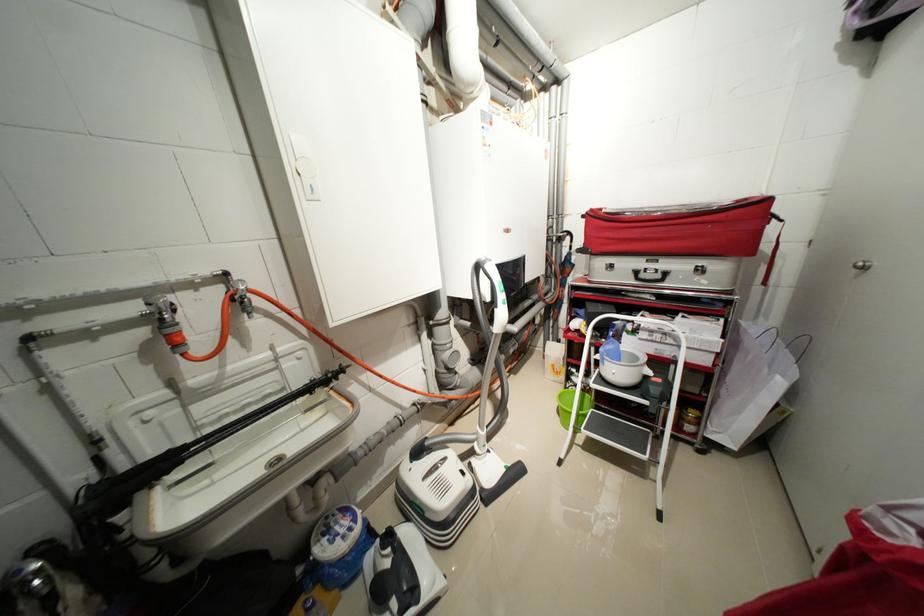
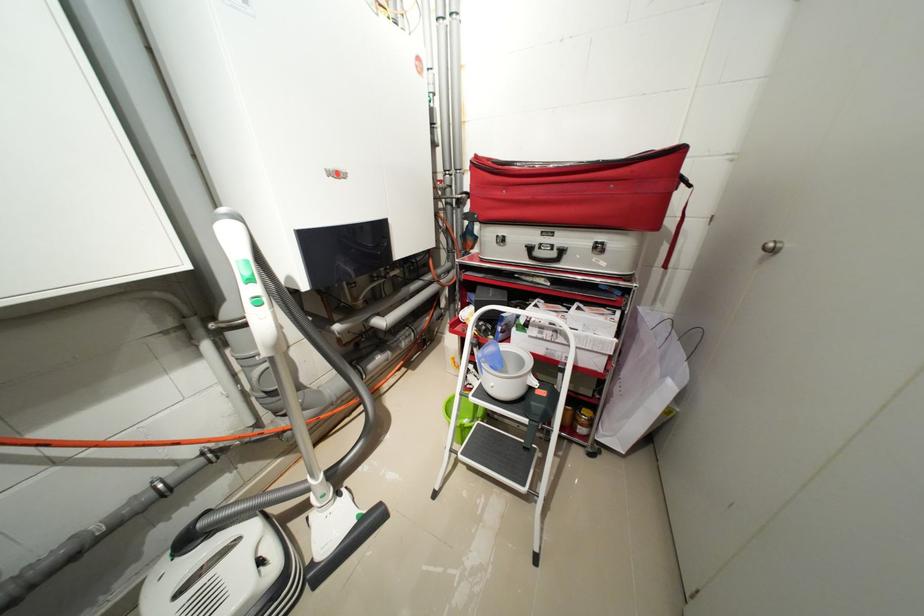
Question: The first image is from the beginning of the video and the second image is from the end. How did the camera likely rotate when shooting the video?

Choices:
 (A) Left
 (B) Right
 (C) Up
 (D) Down

Answer: (B)